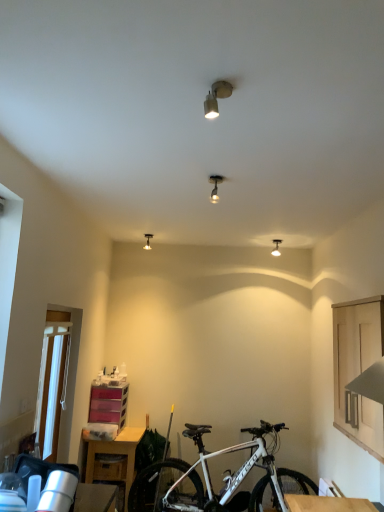
Question: From a real-world perspective, is metallic track light at center, the 2th light fixture positioned from the top, under white matte bicycle at lower center?

Choices:
 (A) no
 (B) yes

Answer: (A)

Question: Is metallic track light at center, which is the 3th light fixture in back-to-front order, not close to white matte bicycle at lower center?

Choices:
 (A) yes
 (B) no

Answer: (A)

Question: Is metallic track light at center, which is the 3th light fixture in back-to-front order, looking in the opposite direction of white matte bicycle at lower center?

Choices:
 (A) no
 (B) yes

Answer: (A)

Question: Is metallic track light at center, which is the 3th light fixture in back-to-front order, wider than white matte bicycle at lower center?

Choices:
 (A) no
 (B) yes

Answer: (A)

Question: Considering the relative sizes of metallic track light at center, the 2th light fixture positioned from the top, and white matte bicycle at lower center in the image provided, is metallic track light at center, the 2th light fixture positioned from the top, smaller than white matte bicycle at lower center?

Choices:
 (A) no
 (B) yes

Answer: (B)

Question: Can white matte bicycle at lower center be found inside metallic track light at center, which is the second light fixture from right to left?

Choices:
 (A) no
 (B) yes

Answer: (A)

Question: Considering the relative sizes of matte silver spotlight at upper center, positioned as the second light fixture in left-to-right order, and matte silver light fixture at upper center, which is counted as the first light fixture, starting from the back, in the image provided, is matte silver spotlight at upper center, positioned as the second light fixture in left-to-right order, thinner than matte silver light fixture at upper center, which is counted as the first light fixture, starting from the back,?

Choices:
 (A) no
 (B) yes

Answer: (B)

Question: Is matte silver spotlight at upper center, the first light fixture when ordered from front to back, bigger than matte silver light fixture at upper center, the 3th light fixture in the top-to-bottom sequence?

Choices:
 (A) no
 (B) yes

Answer: (A)

Question: Considering the relative positions of matte silver spotlight at upper center, the 4th light fixture from the back, and matte silver light fixture at upper center, positioned as the 4th light fixture in right-to-left order, in the image provided, is matte silver spotlight at upper center, the 4th light fixture from the back, to the right of matte silver light fixture at upper center, positioned as the 4th light fixture in right-to-left order, from the viewer's perspective?

Choices:
 (A) no
 (B) yes

Answer: (B)

Question: Is matte silver spotlight at upper center, positioned as the third light fixture in right-to-left order, outside matte silver light fixture at upper center, the 1th light fixture from the left?

Choices:
 (A) no
 (B) yes

Answer: (B)

Question: From the image's perspective, is matte silver spotlight at upper center, the 4th light fixture from the back, under matte silver light fixture at upper center, which is counted as the first light fixture, starting from the back?

Choices:
 (A) no
 (B) yes

Answer: (A)

Question: Considering the relative sizes of matte silver spotlight at upper center, positioned as the fourth light fixture in bottom-to-top order, and matte silver light fixture at upper center, which appears as the second light fixture when ordered from the bottom, in the image provided, is matte silver spotlight at upper center, positioned as the fourth light fixture in bottom-to-top order, shorter than matte silver light fixture at upper center, which appears as the second light fixture when ordered from the bottom,?

Choices:
 (A) yes
 (B) no

Answer: (A)

Question: Can you confirm if transparent glass door at left is thinner than white matte bicycle at lower center?

Choices:
 (A) yes
 (B) no

Answer: (A)